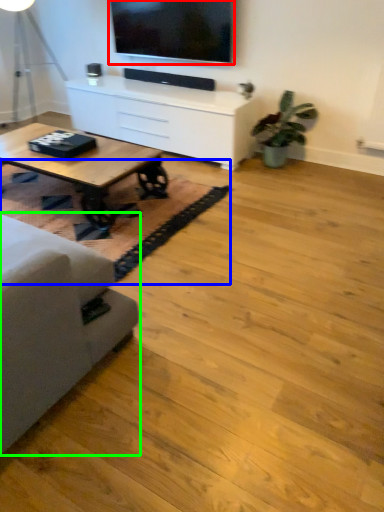
Question: Which object is the closest to the television (highlighted by a red box)? Choose among these: mat (highlighted by a blue box) or studio couch (highlighted by a green box).

Choices:
 (A) mat
 (B) studio couch

Answer: (A)